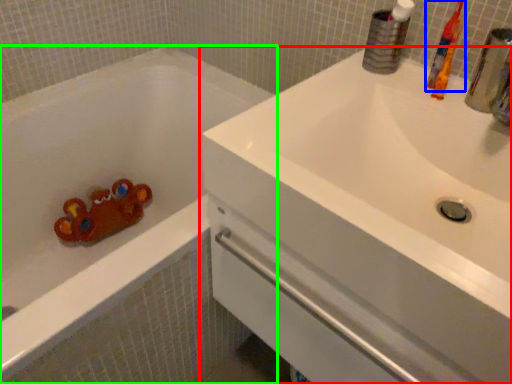
Question: Considering the real-world distances, which object is closest to sink (highlighted by a red box)? toothbrush (highlighted by a blue box) or bathtub (highlighted by a green box).

Choices:
 (A) toothbrush
 (B) bathtub

Answer: (A)